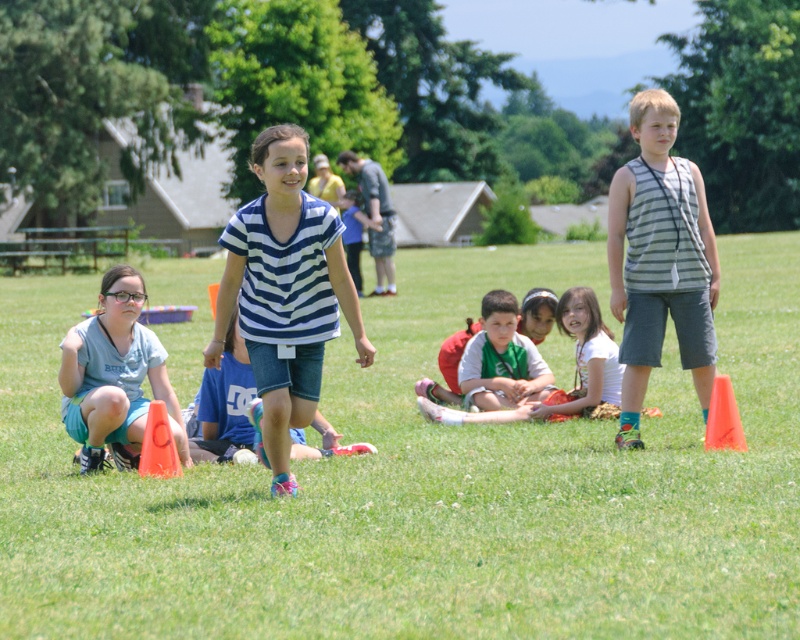
You are a photographer standing in the park and see two shirts in the scene, a striped fabric shirt at center and a white cotton shirt at center. Which shirt should you focus on to capture the one that is closer to you?

The striped fabric shirt at center is closer to the viewer than the white cotton shirt at center, so you should focus on the striped fabric shirt at center to capture the closer one.

You are standing at the camera position and want to know which of the two points, point (352, 545) or point (248, 273), is nearer to you. Can you determine which one is closer?

Point (352, 545) is closer to the camera than point (248, 273), so it is the nearer one.